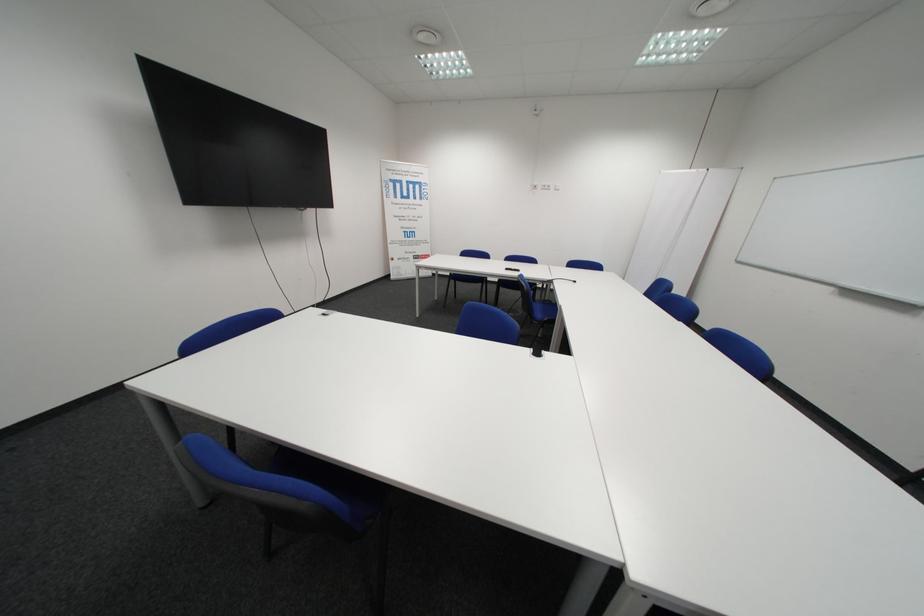
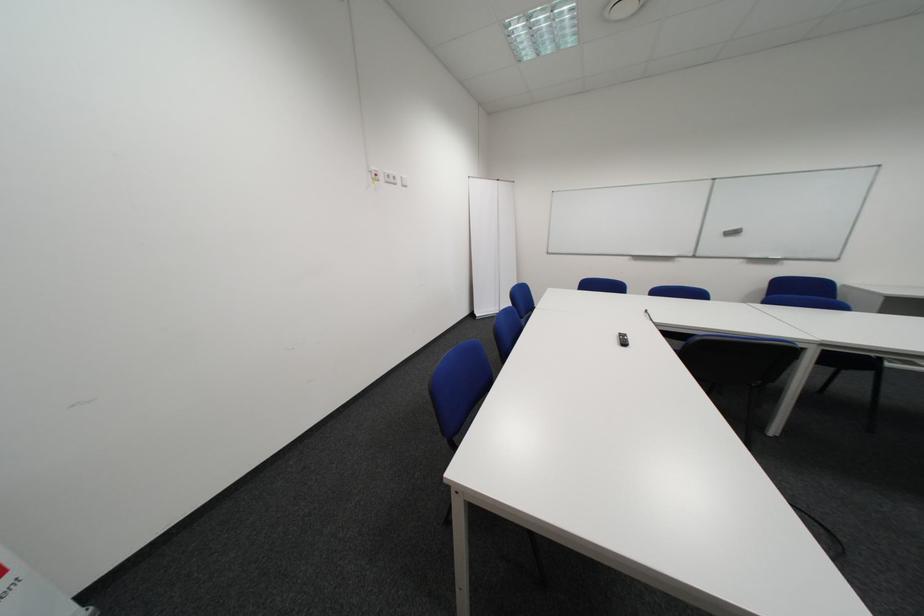
The point at (554, 188) is marked in the first image. Where is the corresponding point in the second image?

(398, 180)